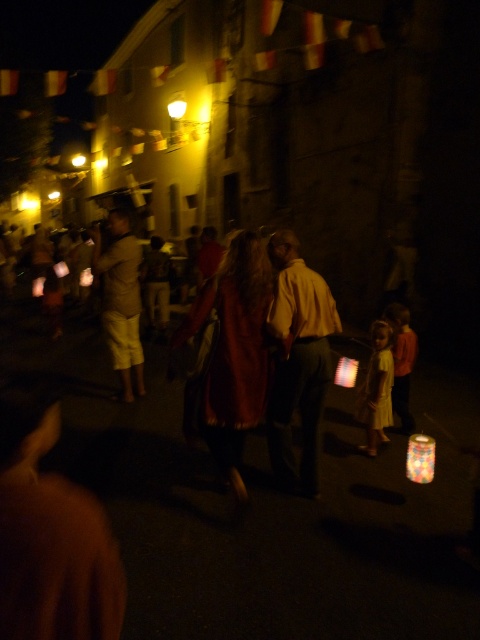
Between velvet red coat at center and yellow matte shirt at center, which one appears on the left side from the viewer's perspective?

velvet red coat at center

Can you confirm if velvet red coat at center is positioned below yellow matte shirt at center?

Yes.

Does point (235, 452) come closer to viewer compared to point (300, 269)?

No, it is behind (300, 269).

Find the location of a particular element. Image resolution: width=480 pixels, height=640 pixels. velvet red coat at center is located at coordinates (233, 352).

Between yellow matte shirt at center and matte khaki shorts at center, which one is positioned lower?

yellow matte shirt at center is lower down.

Between yellow matte shirt at center and matte khaki shorts at center, which one is positioned higher?

matte khaki shorts at center

From the picture: Who is more forward, (x=276, y=410) or (x=123, y=376)?

Point (x=276, y=410) is in front.

The image size is (480, 640). Find the location of `yellow matte shirt at center`. yellow matte shirt at center is located at coordinates (298, 362).

Which is behind, point (254, 307) or point (119, 252)?

Positioned behind is point (119, 252).

This screenshot has width=480, height=640. What do you see at coordinates (233, 352) in the screenshot? I see `velvet red coat at center` at bounding box center [233, 352].

Identify the location of velvet red coat at center. (233, 352).